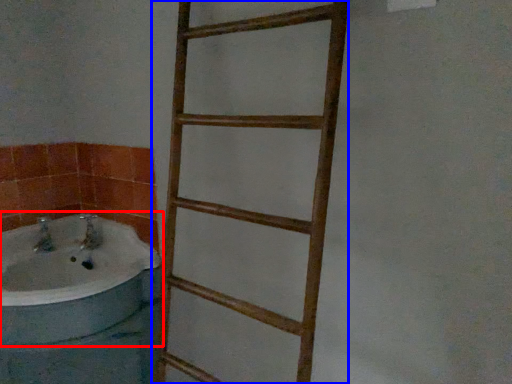
Question: Which point is further to the camera, bathtub (highlighted by a red box) or ladder (highlighted by a blue box)?

Choices:
 (A) bathtub
 (B) ladder

Answer: (A)